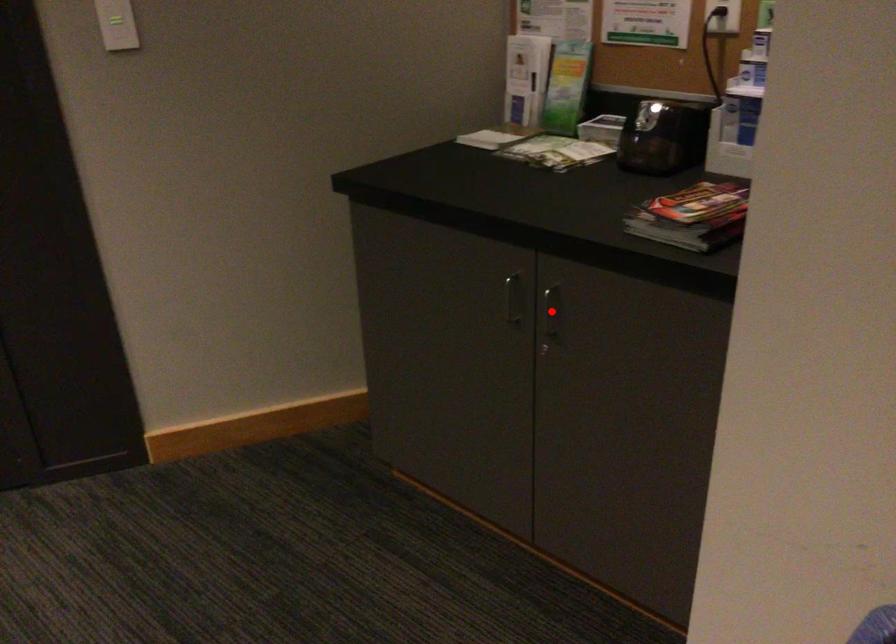
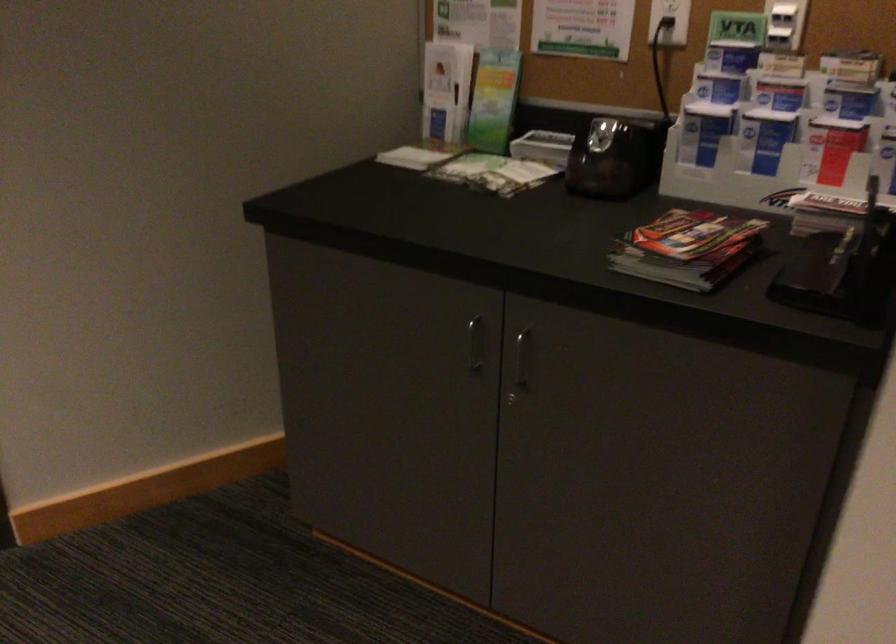
Locate, in the second image, the point that corresponds to the highlighted location in the first image.

(521, 357)